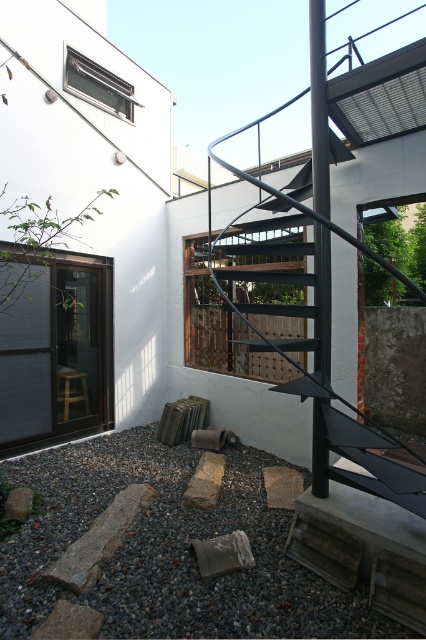
Is gray gravel at lower center above brown rough stone at center?

No.

You are a GUI agent. You are given a task and a screenshot of the screen. Output one action in this format:
    pyautogui.click(x=<x>, y=<y>)
    Task: Click on the gray gravel at lower center
    The height and width of the screenshot is (640, 426).
    Given the screenshot: What is the action you would take?
    pyautogui.click(x=169, y=548)

Identify the location of gray gravel at lower center. The height and width of the screenshot is (640, 426). (169, 548).

Can you confirm if gray gravel at lower center is bigger than gray rough stone at center?

Indeed, gray gravel at lower center has a larger size compared to gray rough stone at center.

Who is shorter, gray gravel at lower center or gray rough stone at center?

gray rough stone at center is shorter.

Is point (376, 614) closer to viewer compared to point (207, 476)?

Yes, it is.

Where is `gray gravel at lower center`? gray gravel at lower center is located at coordinates (169, 548).

Does point (152, 429) come in front of point (83, 260)?

No.

Between gray gravel at lower center and matte black glass door at left, which one is positioned higher?

matte black glass door at left

Who is more forward, [104,573] or [42,358]?

Point [104,573]

The width and height of the screenshot is (426, 640). Find the location of `gray gravel at lower center`. gray gravel at lower center is located at coordinates (169, 548).